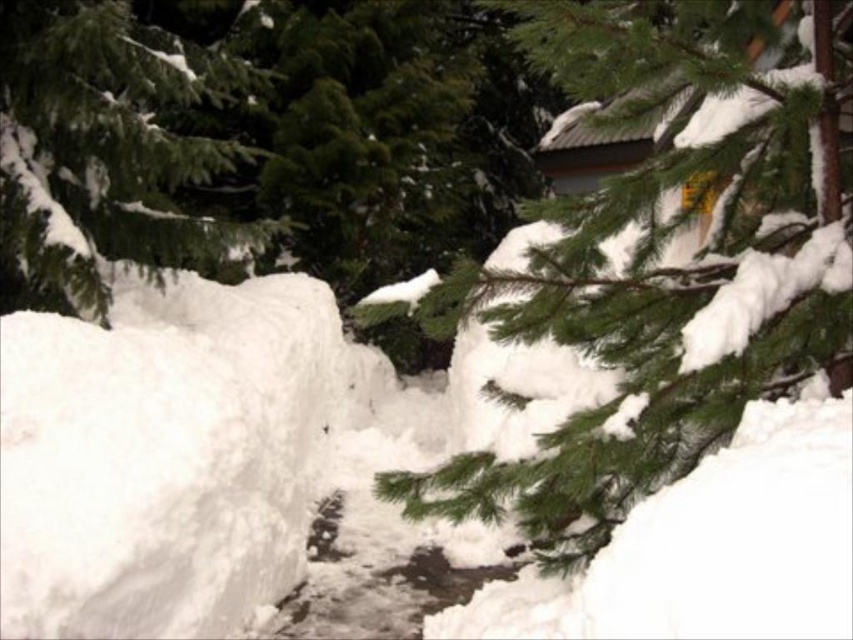
Who is positioned more to the right, white fluffy snow at center or green matte tree branch at upper center?

Positioned to the right is green matte tree branch at upper center.

Which of these two, white fluffy snow at center or green matte tree branch at upper center, stands taller?

With more height is green matte tree branch at upper center.

Measure the distance between white fluffy snow at center and camera.

white fluffy snow at center is 1.89 meters away from camera.

Where is `white fluffy snow at center`? This screenshot has width=853, height=640. white fluffy snow at center is located at coordinates (184, 452).

In the scene shown: Measure the distance between point (288, 465) and camera.

Point (288, 465) is 6.42 meters from camera.

Is point (276, 403) closer to camera compared to point (38, 260)?

No.

Is point (712, 593) behind point (219, 236)?

No, (712, 593) is in front of (219, 236).

Find the location of a particular element. The width and height of the screenshot is (853, 640). white fluffy snow at center is located at coordinates (184, 452).

Who is lower down, green matte tree branch at upper center or green matte tree at upper left?

green matte tree branch at upper center is lower down.

Is green matte tree branch at upper center shorter than green matte tree at upper left?

In fact, green matte tree branch at upper center may be taller than green matte tree at upper left.

Between point (509, 392) and point (68, 310), which one is positioned in front?

Point (509, 392) is more forward.

This screenshot has width=853, height=640. I want to click on green matte tree branch at upper center, so click(x=664, y=259).